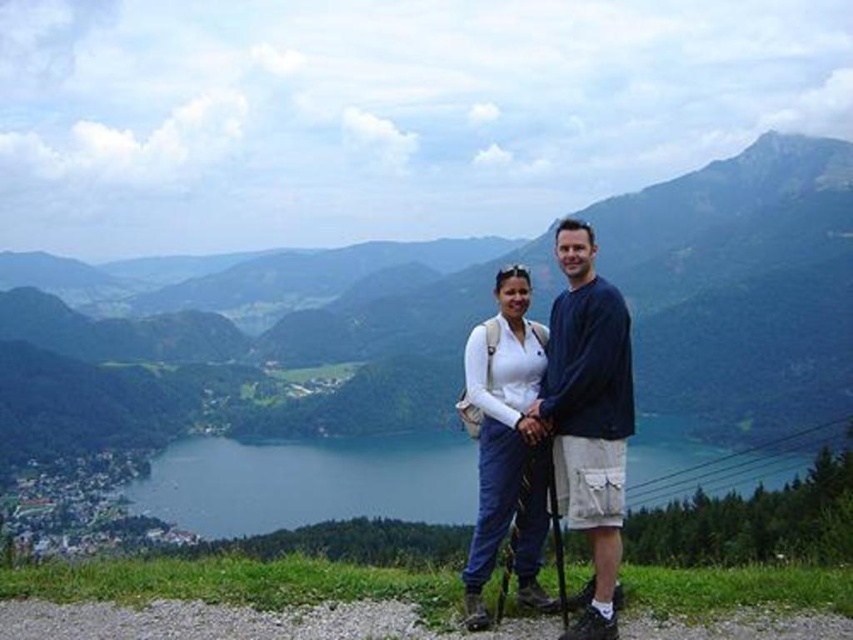
You are planning to take a photo of the green grassy mountain at center and the black rubber ski pole at center from the current viewpoint. Which object will appear larger in the photo?

The green grassy mountain at center will appear larger in the photo because it is much taller than the black rubber ski pole at center.

You are a photographer trying to capture a landscape photo of the two people on the grassy hilltop. The white matte jacket at center is located at point [587,417]. Where should you position the focus point to ensure the white matte jacket at center is in sharp focus?

You should position the focus point at [587,417] to ensure the white matte jacket at center is in sharp focus.

You are a photographer trying to capture a photo of the two objects mentioned. Since the white matte jacket at center and the black rubber ski pole at center are both at the center, how can you ensure both are visible in the frame?

The white matte jacket at center is above the black rubber ski pole at center, so positioning the camera to include both the upper and lower areas of the center will ensure both are visible in the frame.